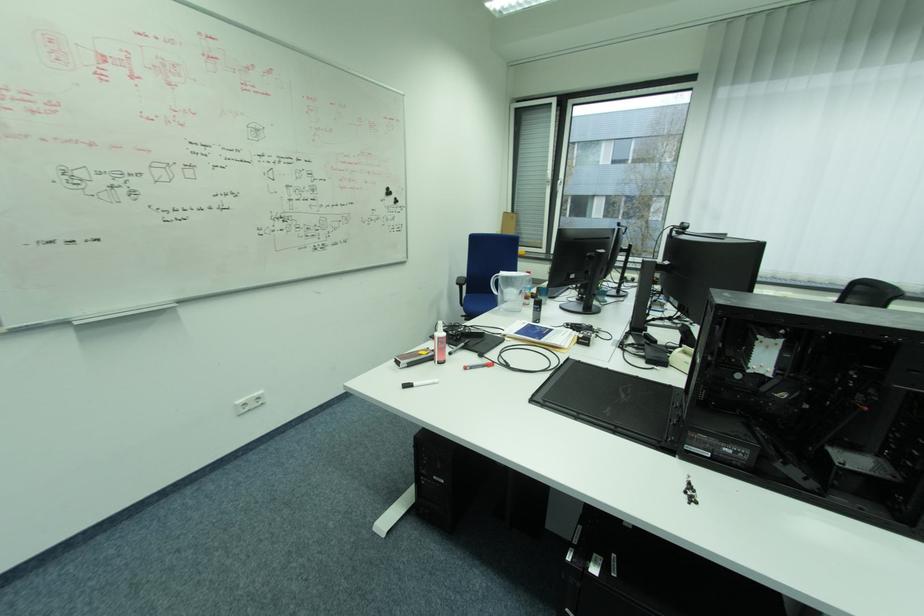
Find where to pull the pitcher handle. Please return your answer as a coordinate pair (x, y).

(493, 284)